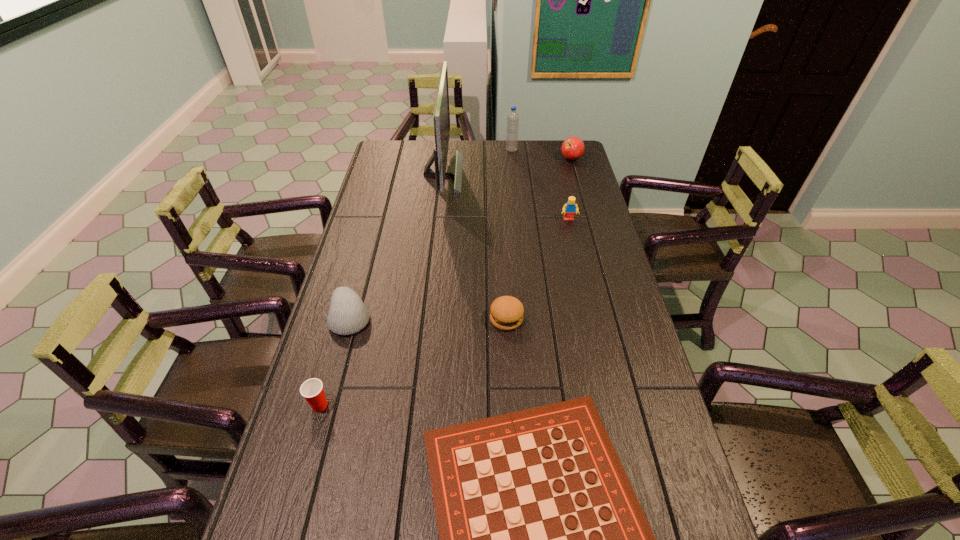
This screenshot has width=960, height=540. I want to click on Lego that is at the right edge, so click(x=569, y=209).

The width and height of the screenshot is (960, 540). Identify the location of object at the far right corner. (572, 148).

Where is `blank space at the far edge`? This screenshot has height=540, width=960. blank space at the far edge is located at coordinates (490, 157).

Identify the location of vacant space at the left edge of the desktop. (318, 431).

Identify the location of vacant space at the right edge. The width and height of the screenshot is (960, 540). (654, 526).

Where is `vacant area at the far left corner of the desktop`? Image resolution: width=960 pixels, height=540 pixels. vacant area at the far left corner of the desktop is located at coordinates (379, 159).

Where is `free area in between the apple and the beanie`? Image resolution: width=960 pixels, height=540 pixels. free area in between the apple and the beanie is located at coordinates (461, 238).

Locate an element on the screen. vacant point located between the second tallest object and the fifth nearest object is located at coordinates (540, 185).

Where is `free space between the monitor and the Dixie cup`? The image size is (960, 540). free space between the monitor and the Dixie cup is located at coordinates (381, 289).

Where is `free spot between the water bottle and the hamburger`? This screenshot has height=540, width=960. free spot between the water bottle and the hamburger is located at coordinates (509, 234).